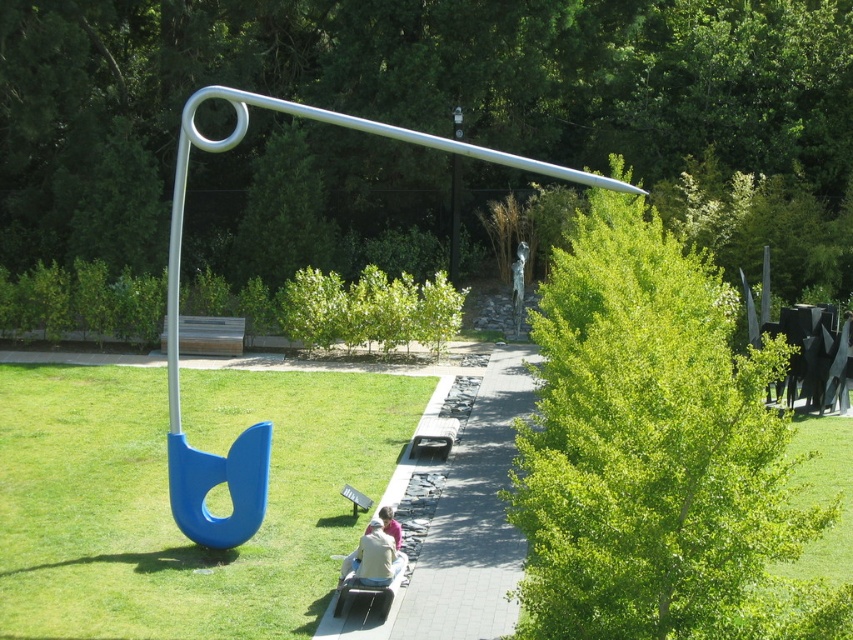
You are standing in the park and want to take a photo of the two points marked in the scene. Which point, point (428, 417) or point (355, 499), is closer to you so it will appear larger in the photo?

Point (428, 417) is closer to you and will appear larger in the photo because it is further to the camera than point (355, 499).

You are standing at the center of the pathway in the park. You want to find the green leafy tree at upper center. According to the coordinates provided, in which direction should you look to see the tree?

The green leafy tree at upper center is located at coordinates point (404, 92), so you should look towards the upper left direction from the center pathway to see it.